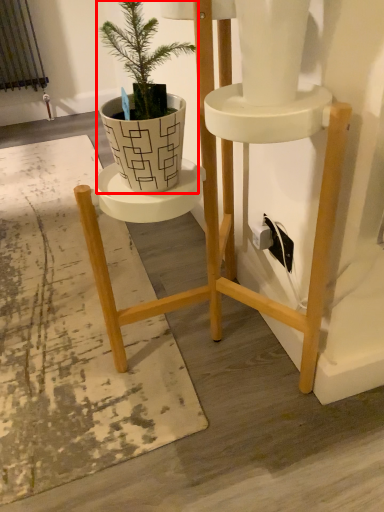
Question: From the image, what is the correct spatial relationship of houseplant (annotated by the red box) in relation to mat?

Choices:
 (A) right
 (B) left

Answer: (A)